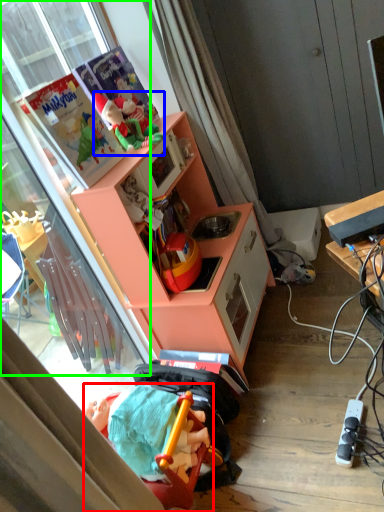
Question: Estimate the real-world distances between objects in this image. Which object is farther from toy (highlighted by a red box), toy (highlighted by a blue box) or glass door (highlighted by a green box)?

Choices:
 (A) toy
 (B) glass door

Answer: (A)